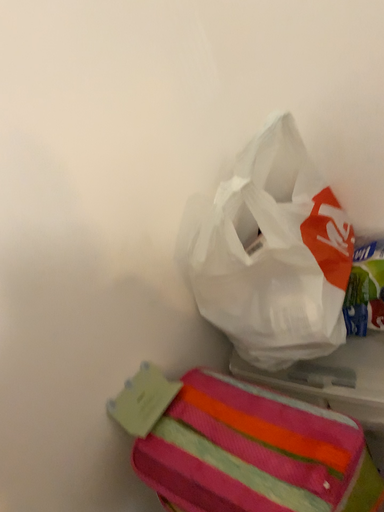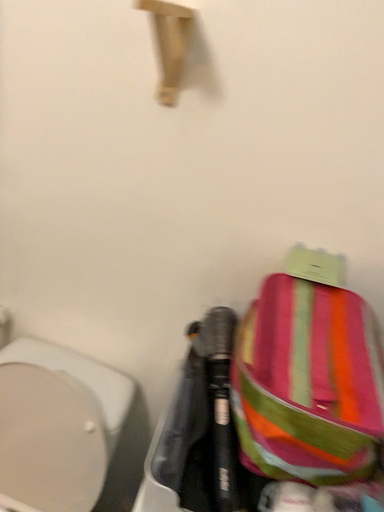
Question: How did the camera likely rotate when shooting the video?

Choices:
 (A) rotated left
 (B) rotated right

Answer: (A)